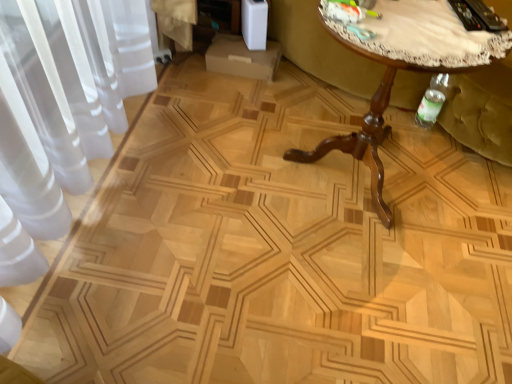
The height and width of the screenshot is (384, 512). I want to click on free space to the left of brown wooden table at center, so click(232, 173).